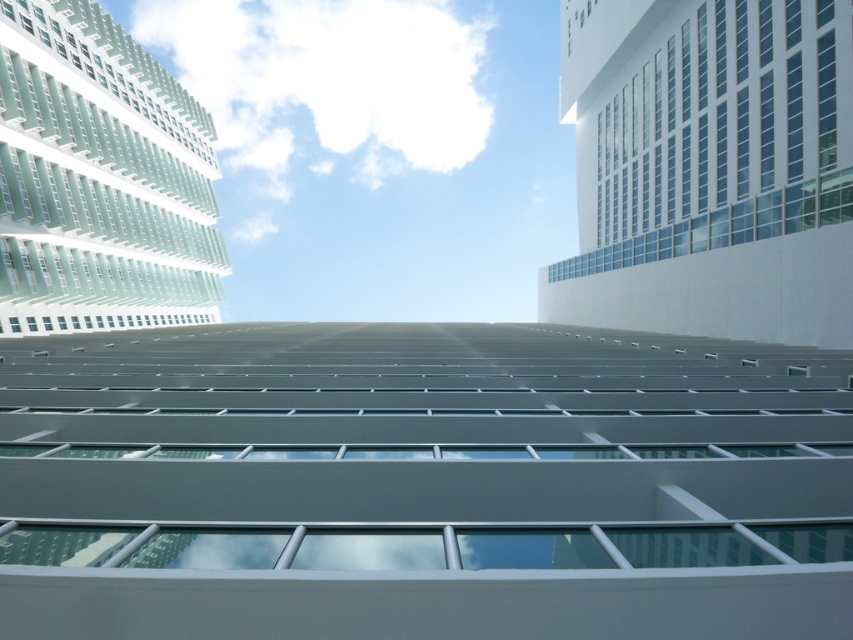
Between point (434, 150) and point (450, 563), which one is positioned behind?

The point (434, 150) is more distant.

Looking at this image, which is more to the right, white fluffy cloud at upper center or white fluffy cloud at center?

Positioned to the right is white fluffy cloud at center.

Which is in front, point (368, 156) or point (300, 564)?

Point (300, 564)

You are a GUI agent. You are given a task and a screenshot of the screen. Output one action in this format:
    pyautogui.click(x=<x>, y=<y>)
    Task: Click on the white fluffy cloud at upper center
    Image resolution: width=853 pixels, height=640 pixels.
    Given the screenshot: What is the action you would take?
    pyautogui.click(x=328, y=83)